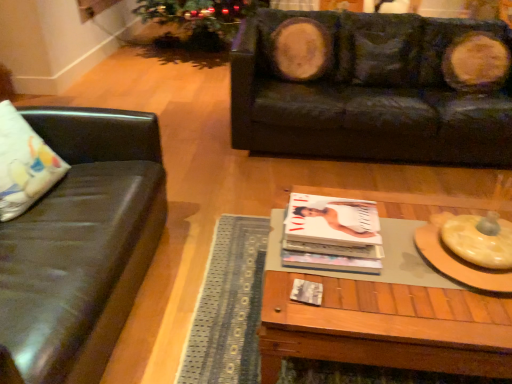
Question: Are matte black couch at left, the second studio couch positioned from the right, and black leather couch at upper right, which ranks as the 2th studio couch in front-to-back order, located far from each other?

Choices:
 (A) yes
 (B) no

Answer: (A)

Question: Is matte black couch at left, which is the 2th studio couch in back-to-front order, thinner than black leather couch at upper right, which ranks as the 2th studio couch in front-to-back order?

Choices:
 (A) no
 (B) yes

Answer: (B)

Question: Considering the relative sizes of matte black couch at left, the 1th studio couch in the front-to-back sequence, and black leather couch at upper right, arranged as the first studio couch when viewed from the right, in the image provided, is matte black couch at left, the 1th studio couch in the front-to-back sequence, shorter than black leather couch at upper right, arranged as the first studio couch when viewed from the right,?

Choices:
 (A) no
 (B) yes

Answer: (B)

Question: Is matte black couch at left, which is the 2th studio couch in back-to-front order, further to camera compared to black leather couch at upper right, which appears as the first studio couch when viewed from the back?

Choices:
 (A) yes
 (B) no

Answer: (B)

Question: Is matte black couch at left, the second studio couch positioned from the right, at the left side of black leather couch at upper right, arranged as the first studio couch when viewed from the right?

Choices:
 (A) yes
 (B) no

Answer: (A)

Question: Is matte black couch at left, the 1th studio couch in the front-to-back sequence, outside black leather couch at upper right, arranged as the first studio couch when viewed from the right?

Choices:
 (A) yes
 (B) no

Answer: (A)

Question: Could woodenwoodencoffee table at center be considered to be inside white fabric pillow at left?

Choices:
 (A) yes
 (B) no

Answer: (B)

Question: Can you confirm if white fabric pillow at left is shorter than woodenwoodencoffee table at center?

Choices:
 (A) no
 (B) yes

Answer: (A)

Question: Is white fabric pillow at left turned away from woodenwoodencoffee table at center?

Choices:
 (A) yes
 (B) no

Answer: (B)

Question: Can you confirm if white fabric pillow at left is positioned to the left of woodenwoodencoffee table at center?

Choices:
 (A) yes
 (B) no

Answer: (A)

Question: Does white fabric pillow at left appear on the right side of woodenwoodencoffee table at center?

Choices:
 (A) no
 (B) yes

Answer: (A)

Question: Considering the relative sizes of white fabric pillow at left and woodenwoodencoffee table at center in the image provided, is white fabric pillow at left smaller than woodenwoodencoffee table at center?

Choices:
 (A) no
 (B) yes

Answer: (B)

Question: Does black leather couch at upper right, placed as the second studio couch when sorted from left to right, lie in front of woodenwoodencoffee table at center?

Choices:
 (A) yes
 (B) no

Answer: (B)